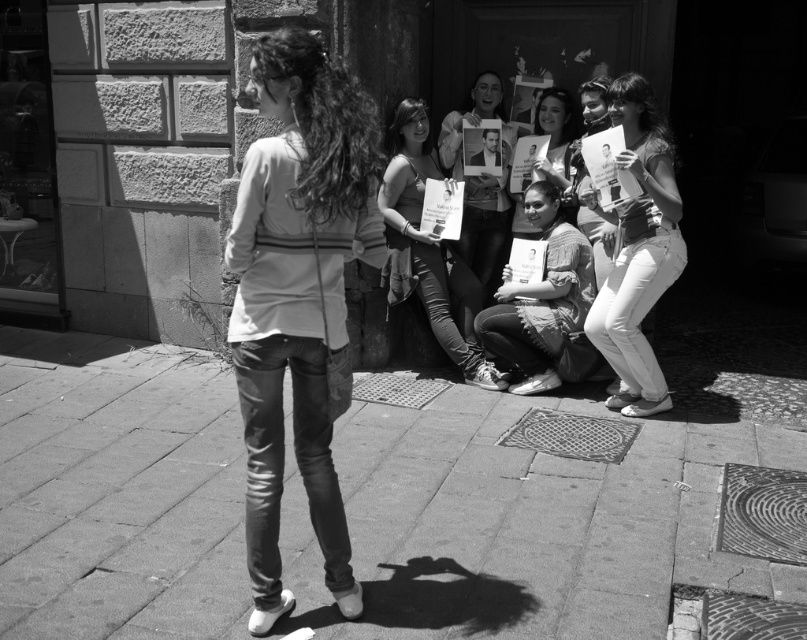
Question: Which of these objects is positioned farthest from the matte fabric shirt at center?

Choices:
 (A) matte paper poster at center
 (B) matte gray sweater at center
 (C) brick pavement at center
 (D) white denim jeans at right

Answer: (B)

Question: Observing the image, what is the correct spatial positioning of white denim jeans at right in reference to matte fabric shirt at center?

Choices:
 (A) right
 (B) left

Answer: (A)

Question: Can you confirm if matte fabric shirt at center is smaller than smooth paper poster at center?

Choices:
 (A) no
 (B) yes

Answer: (A)

Question: Does matte fabric shirt at center have a smaller size compared to smooth paper poster at center?

Choices:
 (A) no
 (B) yes

Answer: (A)

Question: Which is farther from the smooth fabric poster at center?

Choices:
 (A) matte gray sweater at center
 (B) matte fabric shirt at center
 (C) brick pavement at center
 (D) matte paper poster at center

Answer: (A)

Question: Which object is positioned farthest from the matte gray sweater at center?

Choices:
 (A) white denim jeans at right
 (B) smooth fabric poster at center
 (C) smooth paper poster at center

Answer: (B)